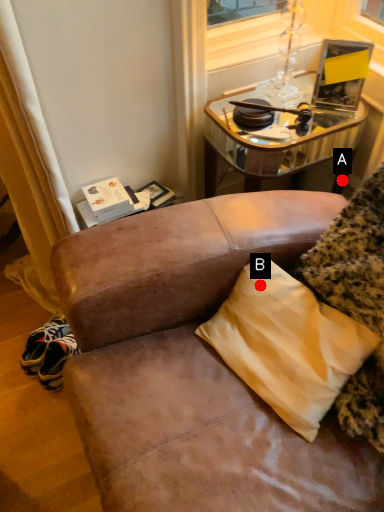
Question: Two points are circled on the image, labeled by A and B beside each circle. Among these points, which one is nearest to the camera?

Choices:
 (A) A is closer
 (B) B is closer

Answer: (B)